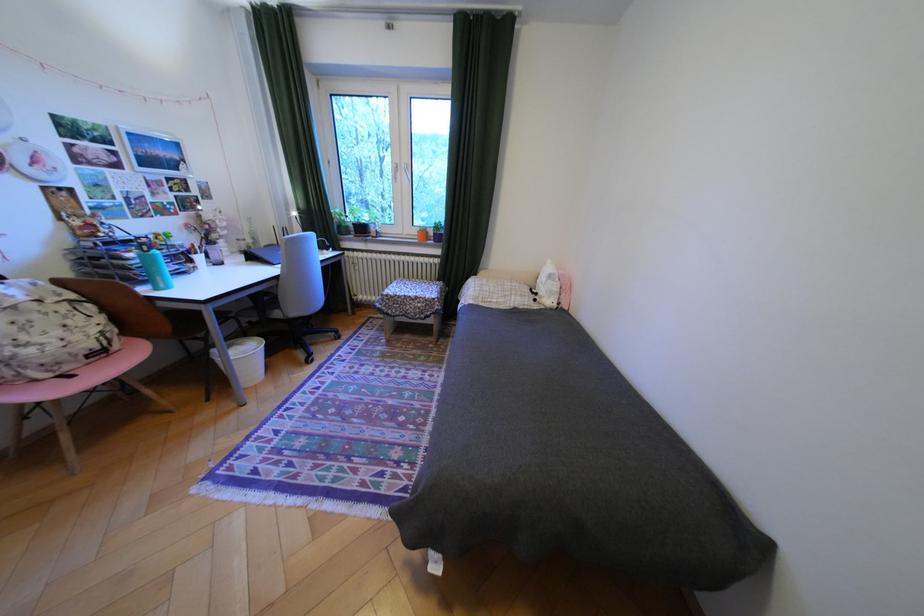
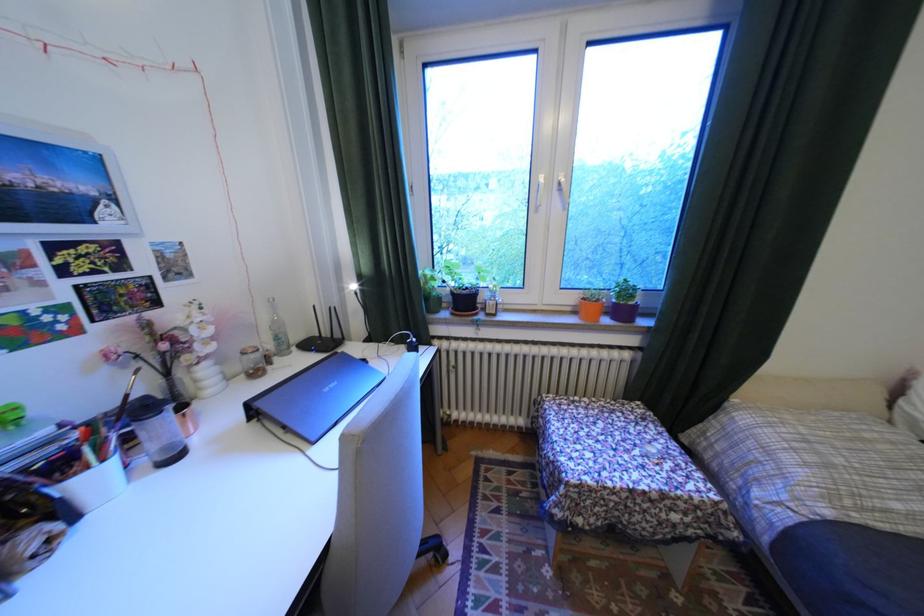
The point at (359,227) is marked in the first image. Where is the corresponding point in the second image?

(451, 299)